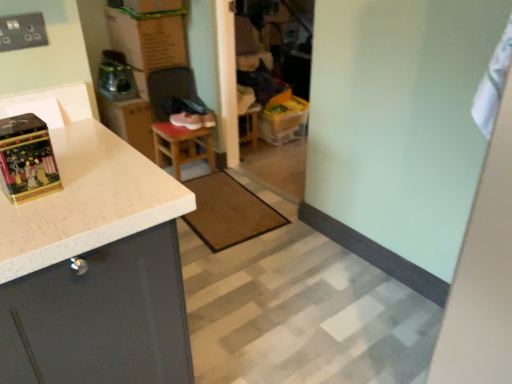
Question: Considering the relative sizes of cardboard box at upper center and gold metallic box at left in the image provided, is cardboard box at upper center shorter than gold metallic box at left?

Choices:
 (A) yes
 (B) no

Answer: (B)

Question: Would you say cardboard box at upper center is outside gold metallic box at left?

Choices:
 (A) yes
 (B) no

Answer: (A)

Question: Would you say gold metallic box at left is part of cardboard box at upper center's contents?

Choices:
 (A) yes
 (B) no

Answer: (B)

Question: From a real-world perspective, is cardboard box at upper center on gold metallic box at left?

Choices:
 (A) no
 (B) yes

Answer: (A)

Question: Could you tell me if cardboard box at upper center is facing gold metallic box at left?

Choices:
 (A) yes
 (B) no

Answer: (B)

Question: Does cardboard box at upper center have a larger size compared to gold metallic box at left?

Choices:
 (A) yes
 (B) no

Answer: (A)

Question: Can you confirm if white fabric at upper right is thinner than white speckled laminate cabinet at left?

Choices:
 (A) yes
 (B) no

Answer: (A)

Question: Is white fabric at upper right closer to camera compared to white speckled laminate cabinet at left?

Choices:
 (A) yes
 (B) no

Answer: (B)

Question: Is white fabric at upper right wider than white speckled laminate cabinet at left?

Choices:
 (A) no
 (B) yes

Answer: (A)

Question: Are white fabric at upper right and white speckled laminate cabinet at left far apart?

Choices:
 (A) no
 (B) yes

Answer: (A)

Question: Does white fabric at upper right have a greater height compared to white speckled laminate cabinet at left?

Choices:
 (A) yes
 (B) no

Answer: (B)

Question: Can you confirm if white fabric at upper right is positioned to the left of white speckled laminate cabinet at left?

Choices:
 (A) no
 (B) yes

Answer: (A)

Question: Does brown textured mat at center appear on the left side of cardboard box at upper center?

Choices:
 (A) yes
 (B) no

Answer: (B)